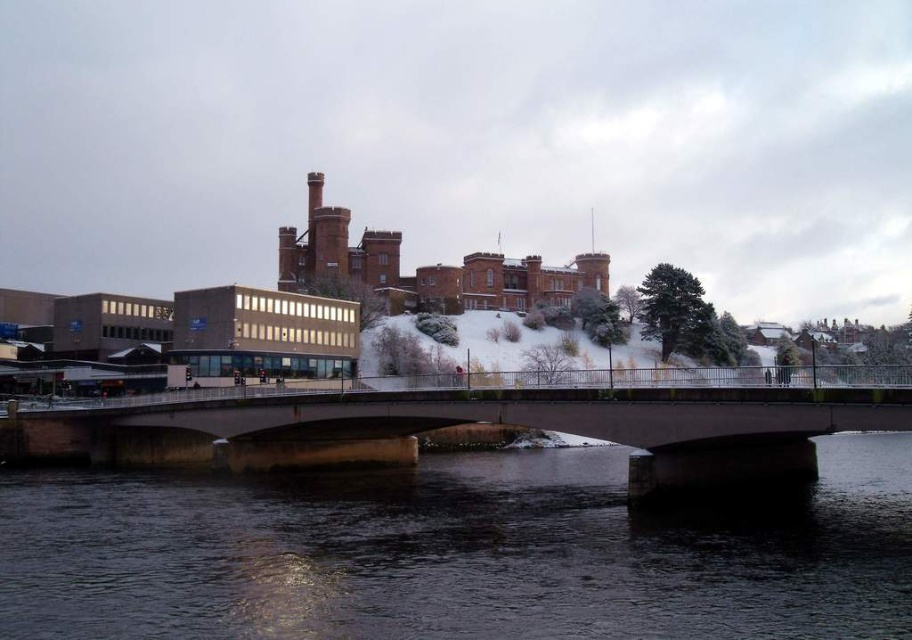
Question: Which object is positioned closest to the concrete bridge at center?

Choices:
 (A) black water at center
 (B) brown brick building at center

Answer: (A)

Question: Which object appears farthest from the camera in this image?

Choices:
 (A) black water at center
 (B) concrete bridge at center
 (C) brown brick building at center

Answer: (C)

Question: Does concrete bridge at center appear under brown brick building at center?

Choices:
 (A) yes
 (B) no

Answer: (A)

Question: Is black water at center to the right of brown brick building at center from the viewer's perspective?

Choices:
 (A) yes
 (B) no

Answer: (A)

Question: Is black water at center wider than brown brick building at center?

Choices:
 (A) yes
 (B) no

Answer: (A)

Question: Estimate the real-world distances between objects in this image. Which object is closer to the brown brick building at center?

Choices:
 (A) black water at center
 (B) concrete bridge at center

Answer: (A)